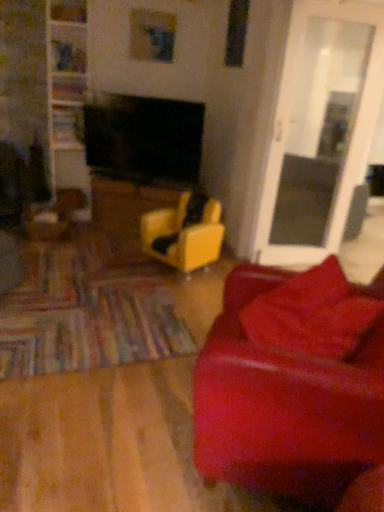
Question: Should I look upward or downward to see yellow matte table at center?

Choices:
 (A) down
 (B) up

Answer: (B)

Question: Is yellow matte table at center in contact with velvet red pillow at lower right?

Choices:
 (A) no
 (B) yes

Answer: (A)

Question: Is yellow matte table at center to the left of velvet red pillow at lower right from the viewer's perspective?

Choices:
 (A) yes
 (B) no

Answer: (A)

Question: Is yellow matte table at center located outside velvet red pillow at lower right?

Choices:
 (A) no
 (B) yes

Answer: (B)

Question: Considering the relative positions of yellow matte table at center and velvet red pillow at lower right in the image provided, is yellow matte table at center to the right of velvet red pillow at lower right from the viewer's perspective?

Choices:
 (A) yes
 (B) no

Answer: (B)

Question: From a real-world perspective, is yellow matte table at center positioned under velvet red pillow at lower right based on gravity?

Choices:
 (A) yes
 (B) no

Answer: (A)

Question: Does yellow matte table at center turn towards velvet red pillow at lower right?

Choices:
 (A) yes
 (B) no

Answer: (B)

Question: Is transparent glass door at right wider than leather couch at right?

Choices:
 (A) yes
 (B) no

Answer: (B)

Question: Is leather couch at right inside transparent glass door at right?

Choices:
 (A) no
 (B) yes

Answer: (A)

Question: Is transparent glass door at right oriented towards leather couch at right?

Choices:
 (A) no
 (B) yes

Answer: (A)

Question: From the image's perspective, is transparent glass door at right on leather couch at right?

Choices:
 (A) no
 (B) yes

Answer: (B)

Question: Is there a large distance between transparent glass door at right and leather couch at right?

Choices:
 (A) yes
 (B) no

Answer: (A)

Question: Is transparent glass door at right oriented away from leather couch at right?

Choices:
 (A) no
 (B) yes

Answer: (A)

Question: Considering the relative positions of yellow leather chair at center and velvet red pillow at lower right in the image provided, is yellow leather chair at center to the left of velvet red pillow at lower right from the viewer's perspective?

Choices:
 (A) no
 (B) yes

Answer: (B)